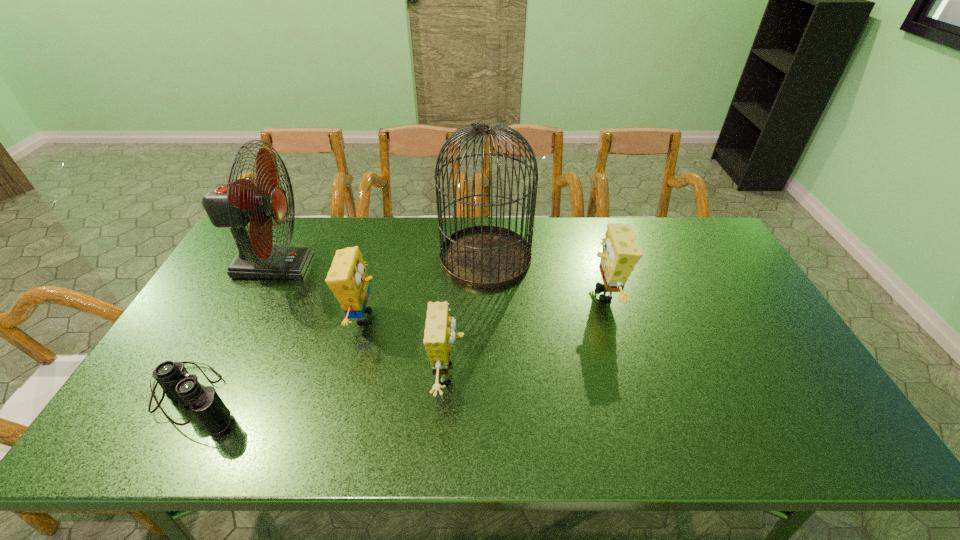
At what (x,y) coordinates should I click in order to perform the action: click on free spot that satisfies the following two spatial constraints: 1. on the back side of the birdcage; 2. on the right side of the shortest object. Please return your answer as a coordinate pair (x, y). Image resolution: width=960 pixels, height=540 pixels. Looking at the image, I should click on (272, 258).